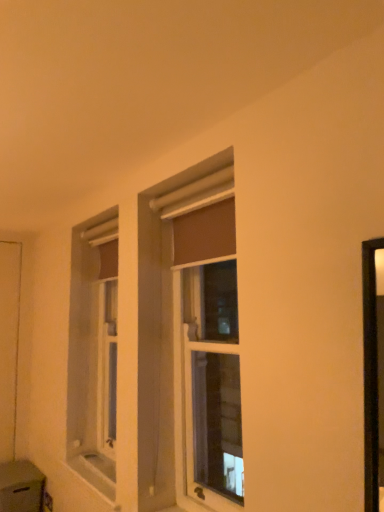
The width and height of the screenshot is (384, 512). Find the location of `matte brown curtain at center`. matte brown curtain at center is located at coordinates (212, 382).

What do you see at coordinates (212, 382) in the screenshot? The width and height of the screenshot is (384, 512). I see `matte brown curtain at center` at bounding box center [212, 382].

The image size is (384, 512). Describe the element at coordinates (9, 344) in the screenshot. I see `white matte screen door at left` at that location.

Locate an element on the screen. This screenshot has width=384, height=512. white matte screen door at left is located at coordinates (9, 344).

Where is `matte brown curtain at center`? matte brown curtain at center is located at coordinates (212, 382).

Does matte brown curtain at center appear on the left side of white matte screen door at left?

No.

Which object is further away from the camera, matte brown curtain at center or white matte screen door at left?

white matte screen door at left is further from the camera.

Does point (210, 394) lie behind point (16, 281)?

That is True.

From the image's perspective, which one is positioned lower, matte brown curtain at center or white matte screen door at left?

white matte screen door at left is shown below in the image.

From the picture: From a real-world perspective, is matte brown curtain at center above or below white matte screen door at left?

From a real-world perspective, matte brown curtain at center is physically above white matte screen door at left.

Considering the relative sizes of matte brown curtain at center and white matte screen door at left in the image provided, is matte brown curtain at center wider than white matte screen door at left?

Indeed, matte brown curtain at center has a greater width compared to white matte screen door at left.

Can you confirm if matte brown curtain at center is taller than white matte screen door at left?

In fact, matte brown curtain at center may be shorter than white matte screen door at left.

Can you confirm if matte brown curtain at center is smaller than white matte screen door at left?

Actually, matte brown curtain at center might be larger than white matte screen door at left.

Would you say matte brown curtain at center is inside or outside white matte screen door at left?

matte brown curtain at center cannot be found inside white matte screen door at left.

Does matte brown curtain at center touch white matte screen door at left?

matte brown curtain at center and white matte screen door at left are not in contact.

Is matte brown curtain at center oriented away from white matte screen door at left?

No, matte brown curtain at center's orientation is not away from white matte screen door at left.

Measure the distance from matte brown curtain at center to white matte screen door at left.

They are 1.72 meters apart.

Locate an element on the screen. The image size is (384, 512). screen door that appears below the matte brown curtain at center (from a real-world perspective) is located at coordinates 9,344.

In the image, is white matte screen door at left on the left side or the right side of matte brown curtain at center?

Based on their positions, white matte screen door at left is located to the left of matte brown curtain at center.

Between white matte screen door at left and matte brown curtain at center, which one is positioned in front?

matte brown curtain at center is in front.

Which point is more forward, (3, 398) or (220, 418)?

Point (3, 398)

From the image's perspective, between white matte screen door at left and matte brown curtain at center, which one is located above?

matte brown curtain at center appears higher in the image.

From a real-world perspective, is white matte screen door at left on matte brown curtain at center?

No, from a real-world perspective, white matte screen door at left is not above matte brown curtain at center.

In terms of width, does white matte screen door at left look wider or thinner when compared to matte brown curtain at center?

Considering their sizes, white matte screen door at left looks slimmer than matte brown curtain at center.

Between white matte screen door at left and matte brown curtain at center, which one has more height?

With more height is white matte screen door at left.

Is white matte screen door at left bigger than matte brown curtain at center?

Actually, white matte screen door at left might be smaller than matte brown curtain at center.

Is white matte screen door at left surrounding matte brown curtain at center?

Actually, matte brown curtain at center is outside white matte screen door at left.

Is white matte screen door at left directly adjacent to matte brown curtain at center?

No.

Is white matte screen door at left aimed at matte brown curtain at center?

No, white matte screen door at left is not aimed at matte brown curtain at center.

At what (x,y) coordinates should I click in order to perform the action: click on window above the white matte screen door at left (from the image's perspective). Please return your answer as a coordinate pair (x, y). This screenshot has width=384, height=512. Looking at the image, I should click on (212, 382).

Where is `screen door below the matte brown curtain at center (from a real-world perspective)`? screen door below the matte brown curtain at center (from a real-world perspective) is located at coordinates (9, 344).

Locate an element on the screen. The image size is (384, 512). screen door that appears below the matte brown curtain at center (from the image's perspective) is located at coordinates (9, 344).